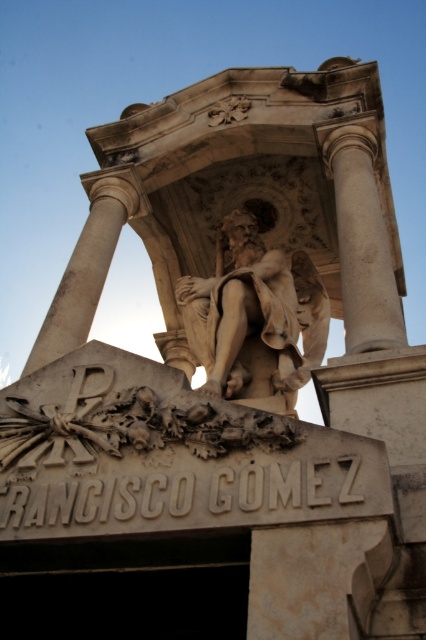
Which is in front, point (255, 310) or point (374, 305)?

Point (374, 305) is more forward.

Which is above, beige stone statue at center or white marble column at center?

Positioned higher is white marble column at center.

Is point (198, 333) farther from camera compared to point (342, 141)?

That is False.

Where is `beige stone statue at center`? The width and height of the screenshot is (426, 640). beige stone statue at center is located at coordinates (255, 316).